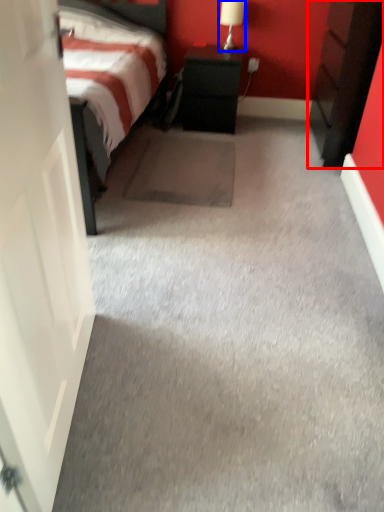
Question: Which object appears farthest to the camera in this image, nightstand (highlighted by a red box) or table lamp (highlighted by a blue box)?

Choices:
 (A) nightstand
 (B) table lamp

Answer: (B)